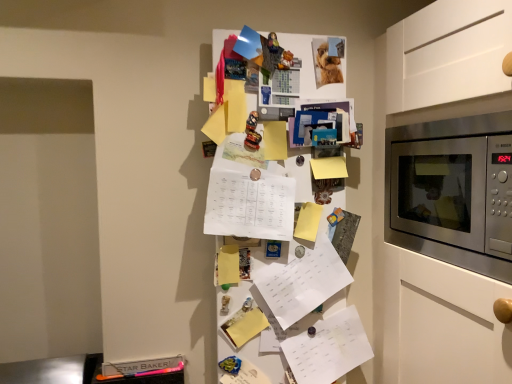
Measure the distance between point (322, 294) and camera.

Point (322, 294) is 1.44 meters from camera.

You are a GUI agent. You are given a task and a screenshot of the screen. Output one action in this format:
    pyautogui.click(x=<x>, y=<y>)
    Task: Click on the white paper at center, arranged as the 2th list when ordered from the bottom
    This screenshot has height=384, width=512.
    Given the screenshot: What is the action you would take?
    pyautogui.click(x=301, y=282)

Where is `white paper at center, acting as the 3th list starting from the top`? white paper at center, acting as the 3th list starting from the top is located at coordinates (328, 348).

Locate an element on the screen. This screenshot has width=512, height=384. stainless steel microwave at right is located at coordinates (443, 190).

In order to face stainless steel microwave at right, should I rotate leftwards or rightwards?

To align with it, rotate right about 29.150°.

In order to click on white paper at center, acting as the 1th list starting from the top in this screenshot , I will do [250, 205].

Where is `white paper at center, the 2th list positioned from the top`? This screenshot has height=384, width=512. white paper at center, the 2th list positioned from the top is located at coordinates (301, 282).

Between white paper at center, acting as the 3th list starting from the top, and white paper at center, the third list positioned from the bottom, which one has smaller size?

With smaller size is white paper at center, acting as the 3th list starting from the top.

Does white paper at center, which is counted as the first list, starting from the bottom, turn towards white paper at center, acting as the 1th list starting from the top?

No, white paper at center, which is counted as the first list, starting from the bottom, is not oriented towards white paper at center, acting as the 1th list starting from the top.

Which object is positioned more to the right, white paper at center, which is counted as the first list, starting from the bottom, or white paper at center, acting as the 1th list starting from the top?

white paper at center, which is counted as the first list, starting from the bottom.

Considering the sizes of white paper at center, which is counted as the first list, starting from the bottom, and stainless steel microwave at right in the image, is white paper at center, which is counted as the first list, starting from the bottom, wider or thinner than stainless steel microwave at right?

Considering their sizes, white paper at center, which is counted as the first list, starting from the bottom, looks slimmer than stainless steel microwave at right.

From the image's perspective, would you say white paper at center, which is counted as the first list, starting from the bottom, is positioned over stainless steel microwave at right?

No.

Does white paper at center, acting as the 3th list starting from the top, have a smaller size compared to stainless steel microwave at right?

Yes.

What's the angular difference between white paper at center, acting as the 3th list starting from the top, and stainless steel microwave at right's facing directions?

91 degrees separate the facing orientations of white paper at center, acting as the 3th list starting from the top, and stainless steel microwave at right.

Would you say white paper at center, acting as the 1th list starting from the top, is a long distance from white paper at center, which is counted as the first list, starting from the bottom?

That's not correct — white paper at center, acting as the 1th list starting from the top, is a little close to white paper at center, which is counted as the first list, starting from the bottom.

From the image's perspective, is white paper at center, acting as the 1th list starting from the top, located above or below white paper at center, acting as the 3th list starting from the top?

Clearly, from the image's perspective, white paper at center, acting as the 1th list starting from the top, is above white paper at center, acting as the 3th list starting from the top.

Is white paper at center, which is counted as the first list, starting from the bottom, completely or partially inside white paper at center, acting as the 1th list starting from the top?

That's incorrect, white paper at center, which is counted as the first list, starting from the bottom, is not inside white paper at center, acting as the 1th list starting from the top.

From a real-world perspective, who is located higher, white paper at center, the 2th list positioned from the top, or white paper at center, the third list positioned from the bottom?

white paper at center, the third list positioned from the bottom, from a real-world perspective.

Considering the relative sizes of white paper at center, the 2th list positioned from the top, and white paper at center, the third list positioned from the bottom, in the image provided, is white paper at center, the 2th list positioned from the top, thinner than white paper at center, the third list positioned from the bottom,?

Yes, white paper at center, the 2th list positioned from the top, is thinner than white paper at center, the third list positioned from the bottom.

Would you say white paper at center, the 2th list positioned from the top, is to the left or to the right of white paper at center, the third list positioned from the bottom, in the picture?

From the image, it's evident that white paper at center, the 2th list positioned from the top, is to the right of white paper at center, the third list positioned from the bottom.

Which is in front, white paper at center, arranged as the 2th list when ordered from the bottom, or white paper at center, acting as the 1th list starting from the top?

white paper at center, acting as the 1th list starting from the top, is closer to the camera.

How different are the orientations of white paper at center, the third list positioned from the bottom, and stainless steel microwave at right in degrees?

The facing directions of white paper at center, the third list positioned from the bottom, and stainless steel microwave at right are 81.1 degrees apart.

Is there a large distance between white paper at center, the third list positioned from the bottom, and stainless steel microwave at right?

white paper at center, the third list positioned from the bottom, is near stainless steel microwave at right, not far away.

Is point (280, 230) more distant than point (392, 197)?

No.

From the image's perspective, who appears lower, stainless steel microwave at right or white paper at center, which is counted as the first list, starting from the bottom?

white paper at center, which is counted as the first list, starting from the bottom.

Could you measure the distance between stainless steel microwave at right and white paper at center, acting as the 3th list starting from the top?

stainless steel microwave at right is 19.92 inches away from white paper at center, acting as the 3th list starting from the top.

Looking at this image, is stainless steel microwave at right touching white paper at center, which is counted as the first list, starting from the bottom?

stainless steel microwave at right is not next to white paper at center, which is counted as the first list, starting from the bottom, and they're not touching.

Is stainless steel microwave at right facing away from white paper at center, acting as the 3th list starting from the top?

No, stainless steel microwave at right is not facing the opposite direction of white paper at center, acting as the 3th list starting from the top.

Is stainless steel microwave at right inside white paper at center, arranged as the 2th list when ordered from the bottom?

Definitely not — stainless steel microwave at right is not inside white paper at center, arranged as the 2th list when ordered from the bottom.

From the image's perspective, between white paper at center, arranged as the 2th list when ordered from the bottom, and stainless steel microwave at right, which one is located above?

stainless steel microwave at right, from the image's perspective.

Considering their positions, is white paper at center, the 2th list positioned from the top, located in front of or behind stainless steel microwave at right?

Clearly, white paper at center, the 2th list positioned from the top, is behind stainless steel microwave at right.

From a real-world perspective, which list is the 2nd one above the white paper at center, acting as the 3th list starting from the top? Please provide its 2D coordinates.

[(250, 205)]

In the image, there is a white paper at center, which is counted as the first list, starting from the bottom. Where is `microwave oven above it (from the image's perspective)`? microwave oven above it (from the image's perspective) is located at coordinates (443, 190).

Looking at the image, which one is located closer to white paper at center, which is counted as the first list, starting from the bottom, white paper at center, the 2th list positioned from the top, or white paper at center, acting as the 1th list starting from the top?

The object closer to white paper at center, which is counted as the first list, starting from the bottom, is white paper at center, the 2th list positioned from the top.

Considering their positions, is stainless steel microwave at right positioned closer to white paper at center, the 2th list positioned from the top, than white paper at center, the third list positioned from the bottom?

Based on the image, white paper at center, the third list positioned from the bottom, appears to be nearer to white paper at center, the 2th list positioned from the top.

When comparing their distances from white paper at center, acting as the 3th list starting from the top, does stainless steel microwave at right or white paper at center, arranged as the 2th list when ordered from the bottom, seem further?

A: stainless steel microwave at right is positioned further to the anchor white paper at center, acting as the 3th list starting from the top.

From the image, which object appears to be farther from white paper at center, acting as the 3th list starting from the top, white paper at center, acting as the 1th list starting from the top, or white paper at center, the 2th list positioned from the top?

white paper at center, acting as the 1th list starting from the top, is further to white paper at center, acting as the 3th list starting from the top.

Looking at the image, which one is located closer to white paper at center, the 2th list positioned from the top, white paper at center, the third list positioned from the bottom, or stainless steel microwave at right?

white paper at center, the third list positioned from the bottom, lies closer to white paper at center, the 2th list positioned from the top, than the other object.

Based on their spatial positions, is white paper at center, which is counted as the first list, starting from the bottom, or white paper at center, the 2th list positioned from the top, further from white paper at center, the third list positioned from the bottom?

white paper at center, which is counted as the first list, starting from the bottom.

Estimate the real-world distances between objects in this image. Which object is further from stainless steel microwave at right, white paper at center, acting as the 1th list starting from the top, or white paper at center, arranged as the 2th list when ordered from the bottom?

Among the two, white paper at center, acting as the 1th list starting from the top, is located further to stainless steel microwave at right.

Estimate the real-world distances between objects in this image. Which object is further from white paper at center, acting as the 1th list starting from the top, stainless steel microwave at right or white paper at center, arranged as the 2th list when ordered from the bottom?

The object further to white paper at center, acting as the 1th list starting from the top, is stainless steel microwave at right.

You are a GUI agent. You are given a task and a screenshot of the screen. Output one action in this format:
    pyautogui.click(x=<x>, y=<y>)
    Task: Click on the list between white paper at center, acting as the 1th list starting from the top, and white paper at center, which is counted as the first list, starting from the bottom, vertically
    Image resolution: width=512 pixels, height=384 pixels.
    Given the screenshot: What is the action you would take?
    pyautogui.click(x=301, y=282)

Locate an element on the screen. This screenshot has height=384, width=512. list located between white paper at center, the 2th list positioned from the top, and stainless steel microwave at right in the left-right direction is located at coordinates (328, 348).